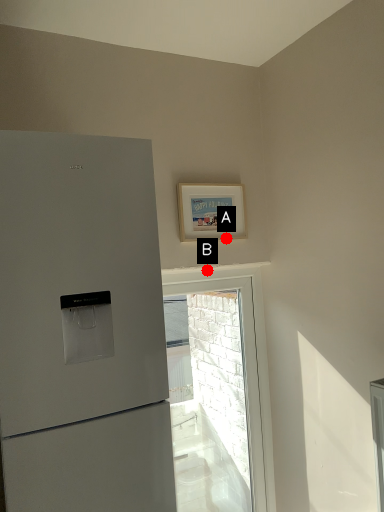
Question: Two points are circled on the image, labeled by A and B beside each circle. Among these points, which one is nearest to the camera?

Choices:
 (A) A is closer
 (B) B is closer

Answer: (B)